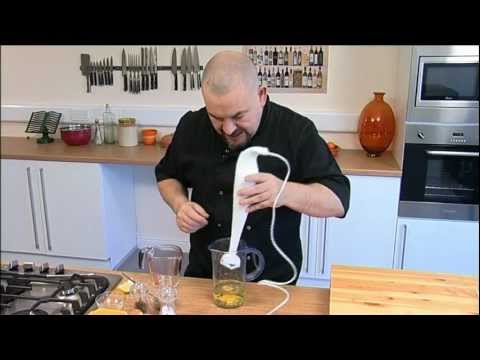
At what (x,y) coordinates should I click in order to perform the action: click on red vase. Please return your answer as a coordinate pair (x, y). The height and width of the screenshot is (360, 480). Looking at the image, I should click on (381, 128).